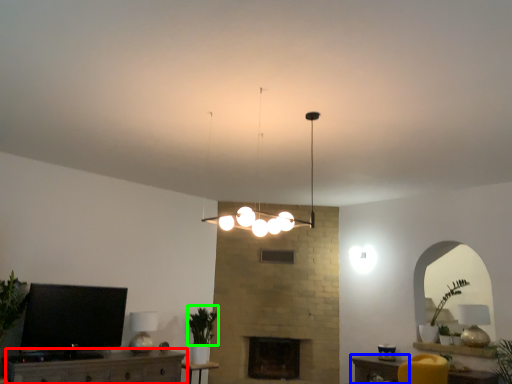
Question: Which object is the farthest from furniture (highlighted by a red box)? Choose among these: table (highlighted by a blue box) or plant (highlighted by a green box).

Choices:
 (A) table
 (B) plant

Answer: (A)